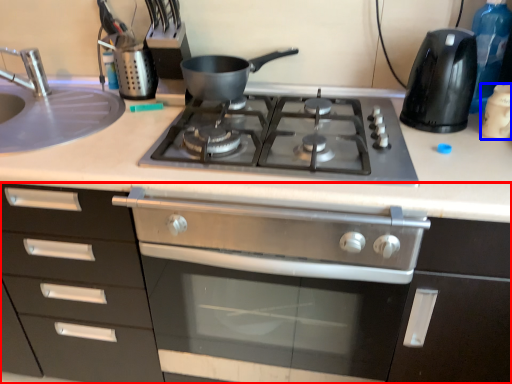
Question: Among these objects, which one is nearest to the camera, cabinetry (highlighted by a red box) or kitchen appliance (highlighted by a blue box)?

Choices:
 (A) cabinetry
 (B) kitchen appliance

Answer: (A)